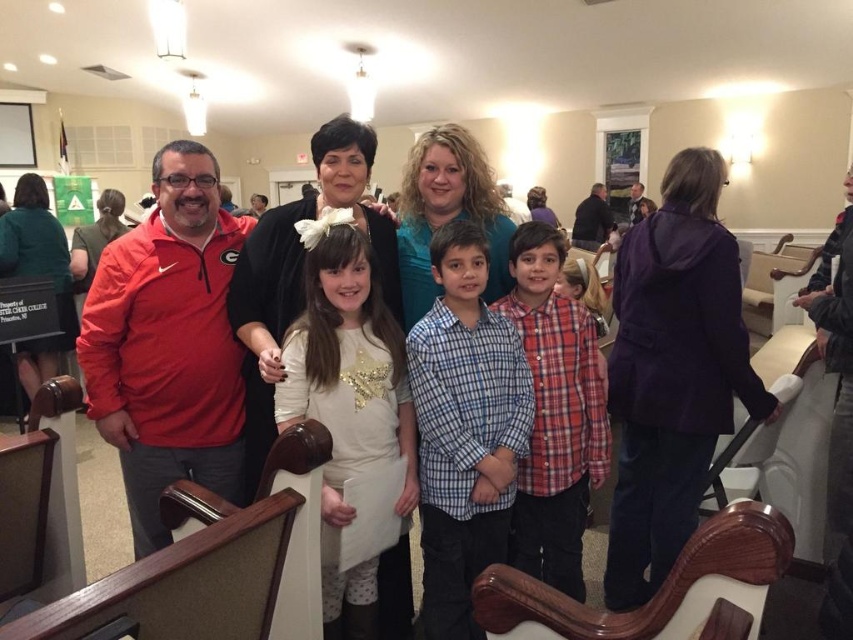
Between blue plaid shirt at center and white sequined dress at center, which one is positioned higher?

blue plaid shirt at center is above.

This screenshot has height=640, width=853. I want to click on blue plaid shirt at center, so click(463, 428).

Between white sequined dress at center and plaid shirt at center, which one has less height?

With less height is plaid shirt at center.

This screenshot has width=853, height=640. Describe the element at coordinates (347, 364) in the screenshot. I see `white sequined dress at center` at that location.

Locate an element on the screen. Image resolution: width=853 pixels, height=640 pixels. white sequined dress at center is located at coordinates (347, 364).

What do you see at coordinates (463, 428) in the screenshot? Image resolution: width=853 pixels, height=640 pixels. I see `blue plaid shirt at center` at bounding box center [463, 428].

Between blue plaid shirt at center and plaid shirt at center, which one has more height?

blue plaid shirt at center is taller.

What do you see at coordinates (463, 428) in the screenshot? The width and height of the screenshot is (853, 640). I see `blue plaid shirt at center` at bounding box center [463, 428].

Identify the location of blue plaid shirt at center. (463, 428).